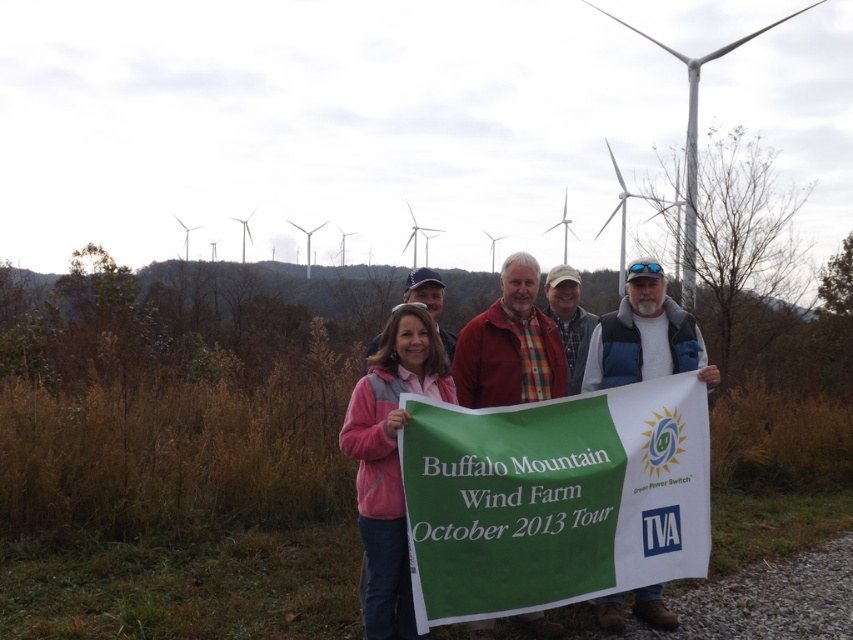
Who is positioned more to the left, matte pink jacket at center or white fleece jacket at center?

Positioned to the left is matte pink jacket at center.

Which is behind, point (527, 264) or point (605, 332)?

Positioned behind is point (605, 332).

Find the location of a particular element. Image resolution: width=853 pixels, height=640 pixels. matte pink jacket at center is located at coordinates (479, 340).

Does point (459, 353) come in front of point (601, 339)?

Yes, it is in front of point (601, 339).

The width and height of the screenshot is (853, 640). Describe the element at coordinates (509, 346) in the screenshot. I see `red plaid shirt at center` at that location.

Identify the location of red plaid shirt at center. The height and width of the screenshot is (640, 853). (509, 346).

Is matte pink jacket at center further to camera compared to pink fleece jacket at center?

Yes.

Who is taller, matte pink jacket at center or pink fleece jacket at center?

With more height is matte pink jacket at center.

At what (x,y) coordinates should I click in order to perform the action: click on matte pink jacket at center. Please return your answer as a coordinate pair (x, y). Looking at the image, I should click on (479, 340).

The height and width of the screenshot is (640, 853). I want to click on matte pink jacket at center, so click(479, 340).